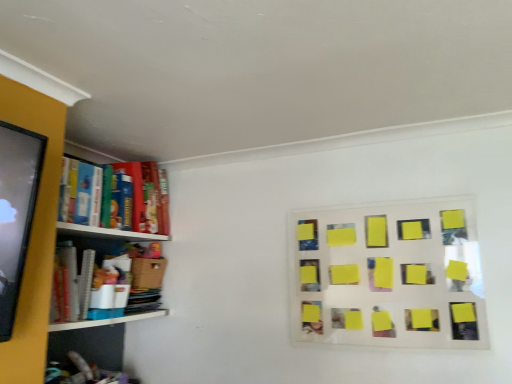
Image resolution: width=512 pixels, height=384 pixels. What do you see at coordinates (388, 275) in the screenshot?
I see `yellow sticky notes at upper right` at bounding box center [388, 275].

You are a GUI agent. You are given a task and a screenshot of the screen. Output one action in this format:
    pyautogui.click(x=<x>, y=<y>)
    Task: Click on the yellow sticky notes at upper right
    The width and height of the screenshot is (512, 384).
    Given the screenshot: What is the action you would take?
    pyautogui.click(x=388, y=275)

What is the approximate width of matte cardboard bookshelf at left?

It is 13.25 inches.

Where is `matte cardboard bookshelf at left`? matte cardboard bookshelf at left is located at coordinates (141, 198).

Describe the element at coordinates (141, 198) in the screenshot. I see `matte cardboard bookshelf at left` at that location.

Locate an element on the screen. Image resolution: width=512 pixels, height=384 pixels. yellow sticky notes at upper right is located at coordinates [388, 275].

Between matte cardboard bookshelf at left and yellow sticky notes at upper right, which one appears on the right side from the viewer's perspective?

Positioned to the right is yellow sticky notes at upper right.

Which object is further away from the camera, matte cardboard bookshelf at left or yellow sticky notes at upper right?

matte cardboard bookshelf at left is further from the camera.

Does point (105, 184) lie behind point (451, 206)?

Yes.

From the image's perspective, between matte cardboard bookshelf at left and yellow sticky notes at upper right, which one is located above?

matte cardboard bookshelf at left.

From a real-world perspective, is matte cardboard bookshelf at left below yellow sticky notes at upper right?

Actually, matte cardboard bookshelf at left is physically above yellow sticky notes at upper right in the real world.

Does matte cardboard bookshelf at left have a lesser width compared to yellow sticky notes at upper right?

No.

In terms of height, does matte cardboard bookshelf at left look taller or shorter compared to yellow sticky notes at upper right?

Clearly, matte cardboard bookshelf at left is shorter compared to yellow sticky notes at upper right.

Between matte cardboard bookshelf at left and yellow sticky notes at upper right, which one has smaller size?

yellow sticky notes at upper right.

Looking at this image, could yellow sticky notes at upper right be considered to be inside matte cardboard bookshelf at left?

No, matte cardboard bookshelf at left does not contain yellow sticky notes at upper right.

Is matte cardboard bookshelf at left with yellow sticky notes at upper right?

matte cardboard bookshelf at left and yellow sticky notes at upper right are not in contact.

Could you tell me if matte cardboard bookshelf at left is facing yellow sticky notes at upper right?

Yes, matte cardboard bookshelf at left is aimed at yellow sticky notes at upper right.

What's the angular difference between matte cardboard bookshelf at left and yellow sticky notes at upper right's facing directions?

90 degrees.

In the scene shown: How much distance is there between matte cardboard bookshelf at left and yellow sticky notes at upper right?

3.55 feet.

In the image, there is a matte cardboard bookshelf at left. What are the coordinates of `bulletin board below it (from a real-world perspective)` in the screenshot? It's located at (388, 275).

Which object is positioned more to the right, yellow sticky notes at upper right or matte cardboard bookshelf at left?

yellow sticky notes at upper right.

Is yellow sticky notes at upper right closer to the viewer compared to matte cardboard bookshelf at left?

Yes, yellow sticky notes at upper right is in front of matte cardboard bookshelf at left.

Is point (413, 260) closer or farther from the camera than point (133, 191)?

Point (413, 260) appears to be closer to the viewer than point (133, 191).

From the image's perspective, is yellow sticky notes at upper right below matte cardboard bookshelf at left?

Yes, from the image's perspective, yellow sticky notes at upper right is beneath matte cardboard bookshelf at left.

From a real-world perspective, is yellow sticky notes at upper right located beneath matte cardboard bookshelf at left?

Yes, from a real-world perspective, yellow sticky notes at upper right is under matte cardboard bookshelf at left.

Considering the relative sizes of yellow sticky notes at upper right and matte cardboard bookshelf at left in the image provided, is yellow sticky notes at upper right wider than matte cardboard bookshelf at left?

No, yellow sticky notes at upper right is not wider than matte cardboard bookshelf at left.

Which of these two, yellow sticky notes at upper right or matte cardboard bookshelf at left, stands taller?

yellow sticky notes at upper right.

Looking at this image, between yellow sticky notes at upper right and matte cardboard bookshelf at left, which one has smaller size?

yellow sticky notes at upper right.

Is yellow sticky notes at upper right surrounding matte cardboard bookshelf at left?

No, yellow sticky notes at upper right does not contain matte cardboard bookshelf at left.

Is yellow sticky notes at upper right directly adjacent to matte cardboard bookshelf at left?

No, yellow sticky notes at upper right is not with matte cardboard bookshelf at left.

Is yellow sticky notes at upper right positioned with its back to matte cardboard bookshelf at left?

yellow sticky notes at upper right does not have its back to matte cardboard bookshelf at left.

Can you tell me how much yellow sticky notes at upper right and matte cardboard bookshelf at left differ in facing direction?

The angular difference between yellow sticky notes at upper right and matte cardboard bookshelf at left is 90 degrees.

What are the coordinates of `bulletin board below the matte cardboard bookshelf at left (from the image's perspective)` in the screenshot? It's located at (388, 275).

The width and height of the screenshot is (512, 384). Identify the location of book on the left side of yellow sticky notes at upper right. (141, 198).

Where is `book behind the yellow sticky notes at upper right`? The width and height of the screenshot is (512, 384). book behind the yellow sticky notes at upper right is located at coordinates (141, 198).